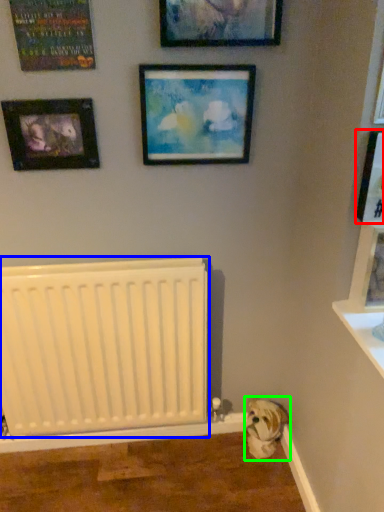
Question: Estimate the real-world distances between objects in this image. Which object is closer to picture frame (highlighted by a red box), radiator (highlighted by a blue box) or animal (highlighted by a green box)?

Choices:
 (A) radiator
 (B) animal

Answer: (A)